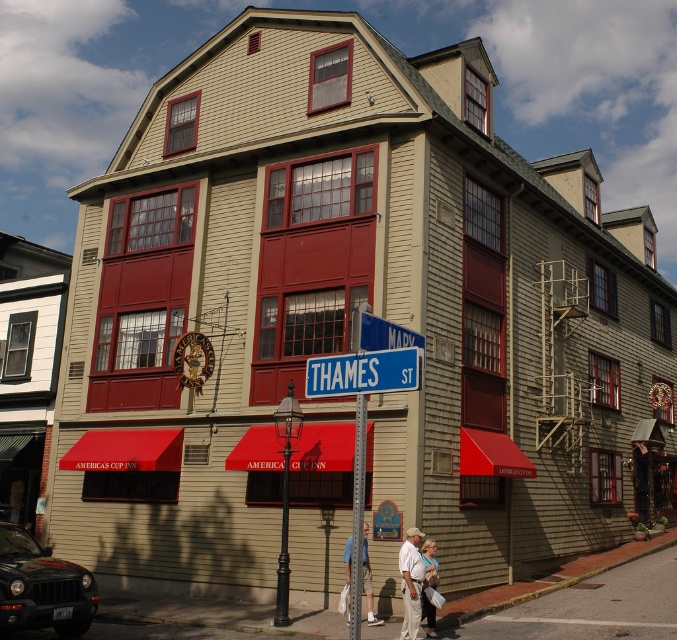
You are standing at the entrance of America Cup Inn and see a black matte car at lower left. If you walk straight towards the car, how far will you have to walk to reach it?

The black matte car at lower left is 10.12 meters away from camera, so you will have to walk 10.12 meters to reach it.

You are a delivery driver who needs to park your 5.5 meter long truck between the black matte car at lower left and the blue metal street sign at center. Is there enough space for your truck?

The distance between the black matte car at lower left and the blue metal street sign at center is 5.95 meters. Since your truck is 5.5 meters long, there is sufficient space to park it between them.